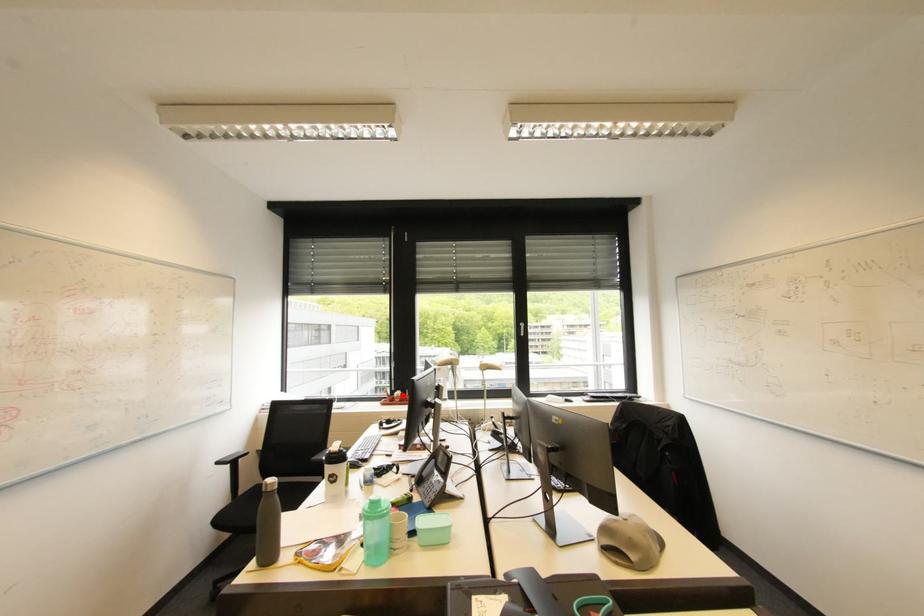
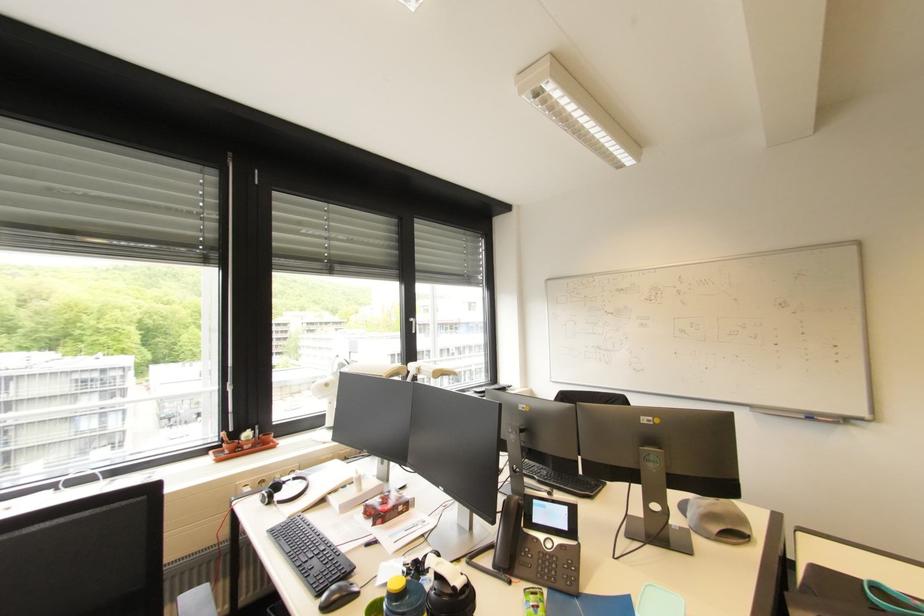
Question: I am providing you with two images of the same scene from different viewpoints. Image1 has a red point marked. In image2, the corresponding 3D location appears at what relative position? Reply with the corresponding letter.

Choices:
 (A) Closer
 (B) Farther

Answer: (A)